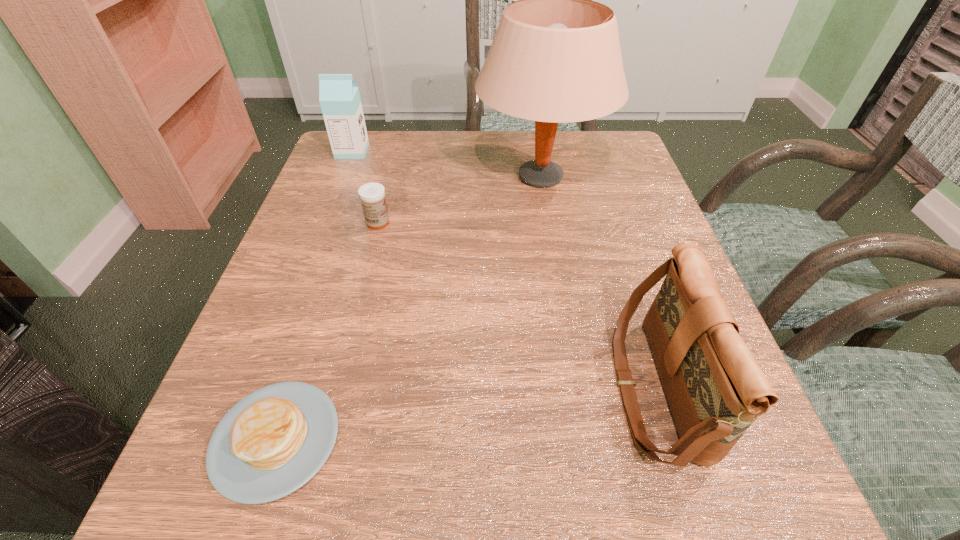
In order to click on lampshade in this screenshot , I will do point(555,58).

Identify the location of milk carton. (339, 97).

You are a GUI agent. You are given a task and a screenshot of the screen. Output one action in this format:
    pyautogui.click(x=<x>, y=<y>)
    Task: Click on the shoulder bag
    The image size is (960, 540).
    Given the screenshot: What is the action you would take?
    pyautogui.click(x=715, y=388)

Image resolution: width=960 pixels, height=540 pixels. Find the location of `medicine`. medicine is located at coordinates (372, 195).

Where is `pancake`? Image resolution: width=960 pixels, height=540 pixels. pancake is located at coordinates (272, 442).

The width and height of the screenshot is (960, 540). I want to click on vacant space located on the front-facing side of the tallest object, so click(x=563, y=304).

Identify the location of free spot located on the back of the milk carton. The height and width of the screenshot is (540, 960). (359, 134).

I want to click on free region located 0.130m on the front-facing side of the shoulder bag, so click(530, 388).

Locate an element on the screen. The width and height of the screenshot is (960, 540). vacant space located 0.270m on the front-facing side of the shoulder bag is located at coordinates (435, 388).

You are a GUI agent. You are given a task and a screenshot of the screen. Output one action in this format:
    pyautogui.click(x=<x>, y=<y>)
    Task: Click on the vacant space located on the front-facing side of the shoulder bag
    
    Given the screenshot: What is the action you would take?
    pyautogui.click(x=401, y=388)